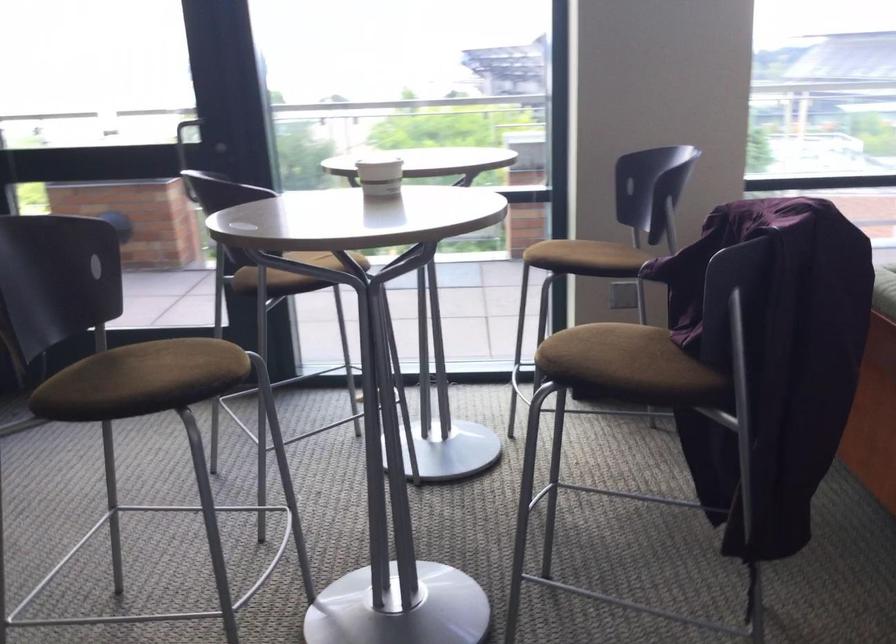
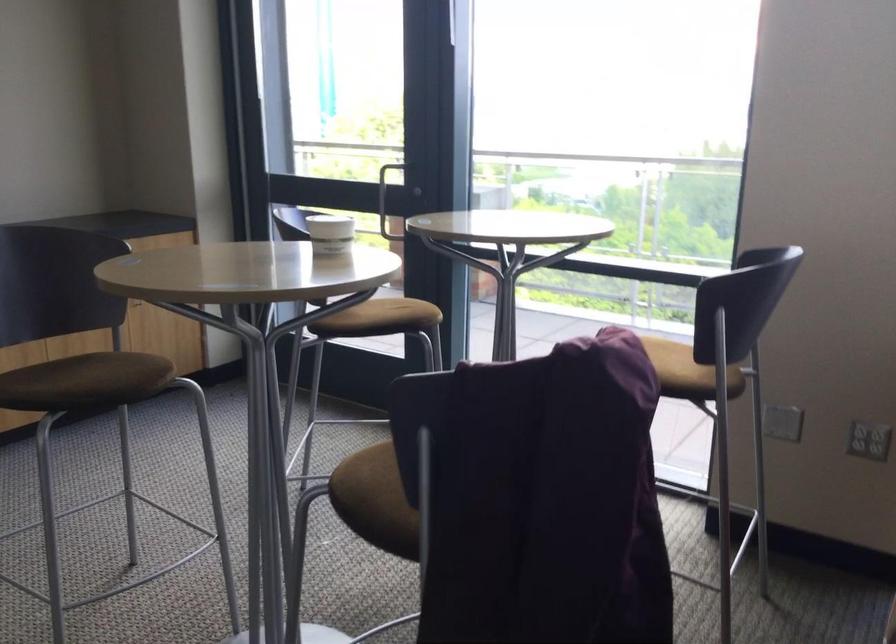
Where in the second image is the point corresponding to (x=597, y=250) from the first image?

(669, 359)